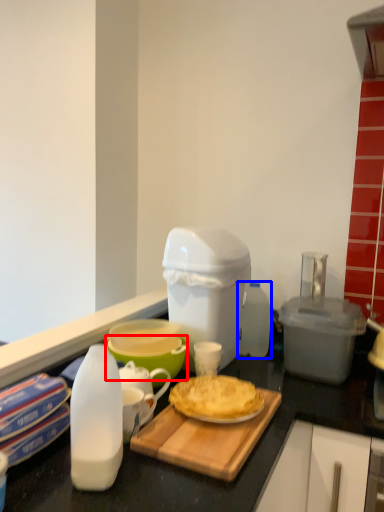
Question: Which of the following is the farthest to the observer, bowl (highlighted by a red box) or bottle (highlighted by a blue box)?

Choices:
 (A) bowl
 (B) bottle

Answer: (B)